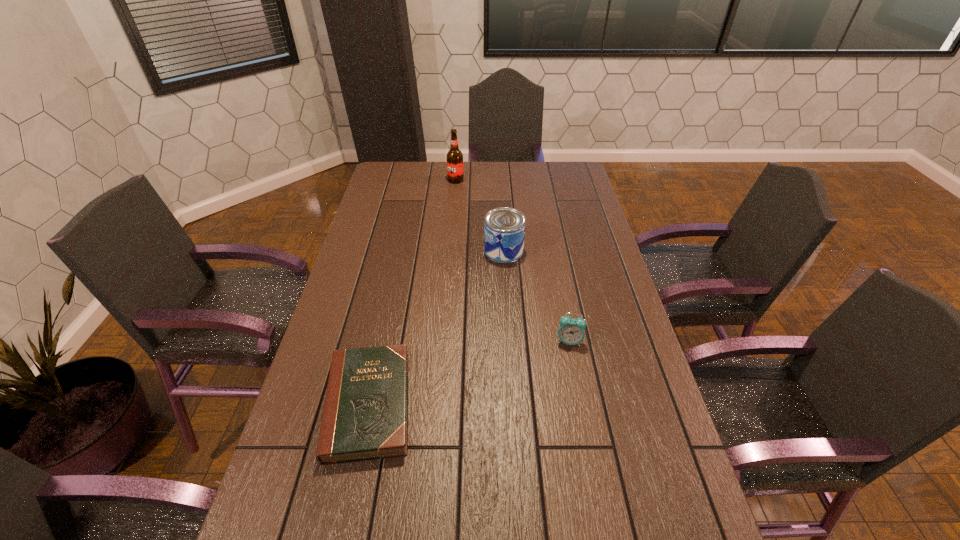
Image resolution: width=960 pixels, height=540 pixels. In the image, there is a desktop. Find the location of `vacant space at the far right corner`. vacant space at the far right corner is located at coordinates (570, 174).

The width and height of the screenshot is (960, 540). Identify the location of empty location between the Bible and the third nearest object. (436, 327).

Find the location of a particular element. free area in between the shortest object and the rightmost object is located at coordinates (468, 373).

Image resolution: width=960 pixels, height=540 pixels. Identify the location of empty space between the second object from right to left and the shortest object. (436, 327).

Image resolution: width=960 pixels, height=540 pixels. Find the location of `vacant space that's between the root beer and the second tallest object`. vacant space that's between the root beer and the second tallest object is located at coordinates (480, 215).

Locate an element on the screen. The width and height of the screenshot is (960, 540). free space that is in between the second shortest object and the second tallest object is located at coordinates (537, 296).

Locate an element on the screen. unoccupied area between the second tallest object and the alarm clock is located at coordinates (537, 296).

Locate an element on the screen. This screenshot has width=960, height=540. vacant space that is in between the can and the shortest object is located at coordinates (436, 327).

The image size is (960, 540). What are the coordinates of `unoccupied area between the Bible and the second tallest object` in the screenshot? It's located at (436, 327).

Where is `vacant area that lies between the third tallest object and the shortest object`? The height and width of the screenshot is (540, 960). vacant area that lies between the third tallest object and the shortest object is located at coordinates (468, 373).